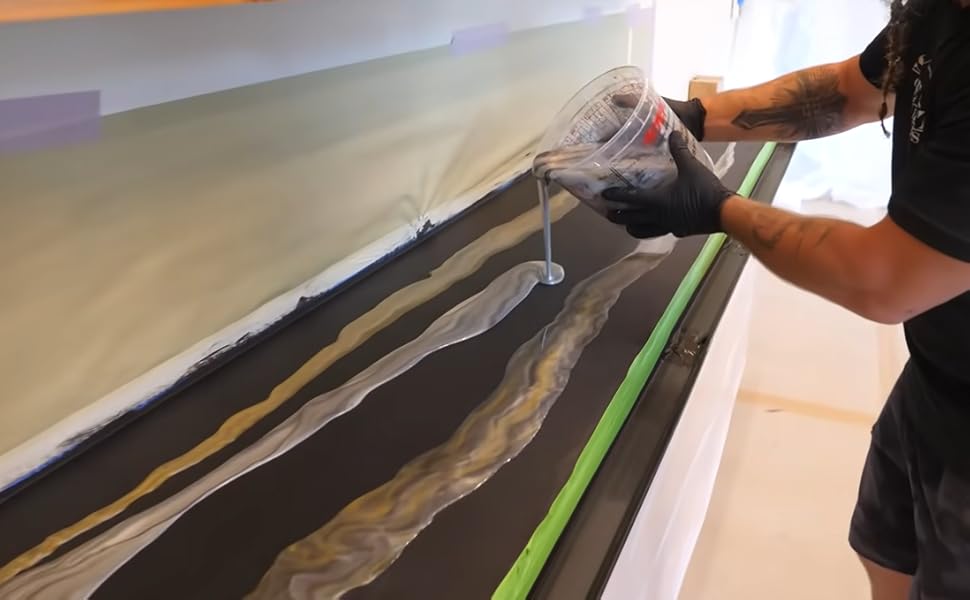
Where is `floor`? floor is located at coordinates (798, 511), (818, 341).